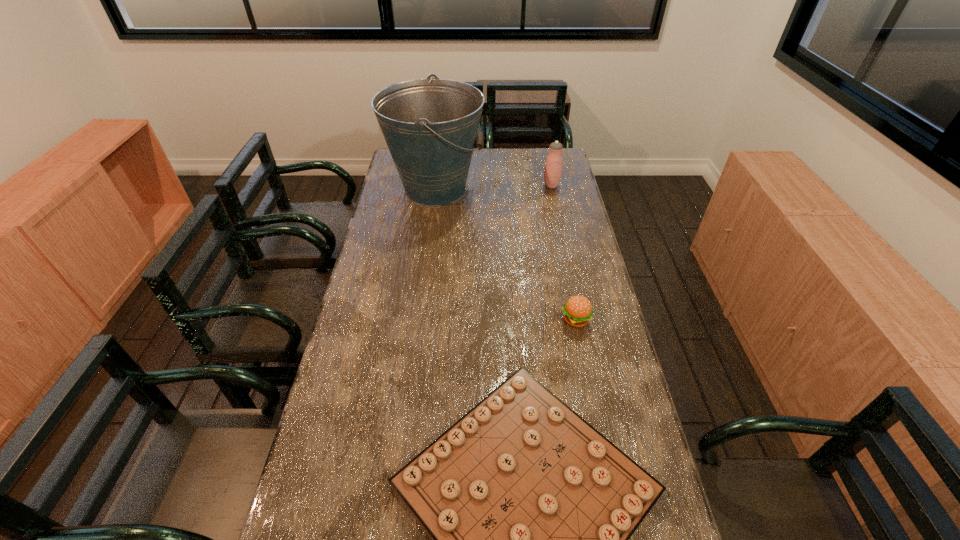
Locate an element on the screen. The width and height of the screenshot is (960, 540). object that is the second closest one to the second tallest object is located at coordinates (578, 311).

I want to click on object that stands as the closest to the third shortest object, so click(430, 126).

Where is `free region that satisfies the following two spatial constraints: 1. with the handle on opposite sides of the tallest object; 2. on the back side of the hamburger`? free region that satisfies the following two spatial constraints: 1. with the handle on opposite sides of the tallest object; 2. on the back side of the hamburger is located at coordinates (419, 320).

Image resolution: width=960 pixels, height=540 pixels. In order to click on vacant space that satisfies the following two spatial constraints: 1. on the back side of the hamburger; 2. with the handle on opposite sides of the tallest object in this screenshot , I will do `click(549, 189)`.

Locate an element on the screen. The width and height of the screenshot is (960, 540). free spot that satisfies the following two spatial constraints: 1. on the back side of the hamburger; 2. with the handle on opposite sides of the tallest object is located at coordinates (549, 189).